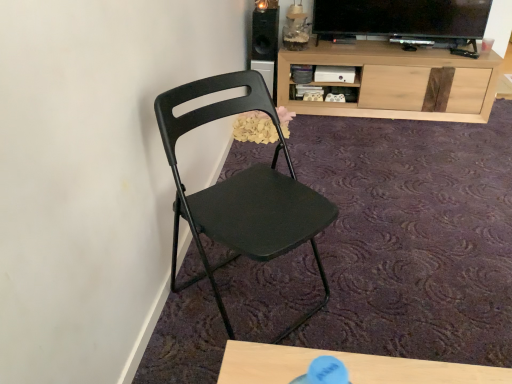
Question: Are matte black folding chair at center and black matte speaker at upper center far apart?

Choices:
 (A) yes
 (B) no

Answer: (A)

Question: From the image's perspective, would you say matte black folding chair at center is positioned over black matte speaker at upper center?

Choices:
 (A) no
 (B) yes

Answer: (A)

Question: Is matte black folding chair at center smaller than black matte speaker at upper center?

Choices:
 (A) no
 (B) yes

Answer: (A)

Question: From a real-world perspective, is matte black folding chair at center on black matte speaker at upper center?

Choices:
 (A) no
 (B) yes

Answer: (A)

Question: Can we say matte black folding chair at center lies outside black matte speaker at upper center?

Choices:
 (A) no
 (B) yes

Answer: (B)

Question: Can you see matte black folding chair at center touching black matte speaker at upper center?

Choices:
 (A) no
 (B) yes

Answer: (A)

Question: Can you confirm if black matte speaker at upper center is taller than matte black folding chair at center?

Choices:
 (A) no
 (B) yes

Answer: (A)

Question: Can you confirm if black matte speaker at upper center is positioned to the right of matte black folding chair at center?

Choices:
 (A) yes
 (B) no

Answer: (A)

Question: From a real-world perspective, does black matte speaker at upper center sit lower than matte black folding chair at center?

Choices:
 (A) no
 (B) yes

Answer: (A)

Question: Does black matte speaker at upper center appear on the left side of matte black folding chair at center?

Choices:
 (A) yes
 (B) no

Answer: (B)

Question: Does black matte speaker at upper center come behind matte black folding chair at center?

Choices:
 (A) no
 (B) yes

Answer: (B)

Question: Is the surface of black matte speaker at upper center in direct contact with matte black folding chair at center?

Choices:
 (A) yes
 (B) no

Answer: (B)

Question: Is black matte speaker at upper center to the left of light wood cabinet at upper right from the viewer's perspective?

Choices:
 (A) no
 (B) yes

Answer: (B)